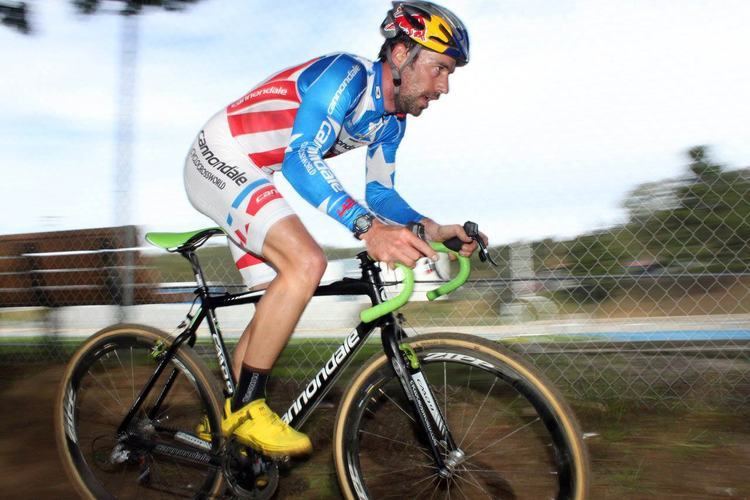
The height and width of the screenshot is (500, 750). In order to click on brown bench in this screenshot , I will do `click(75, 264)`.